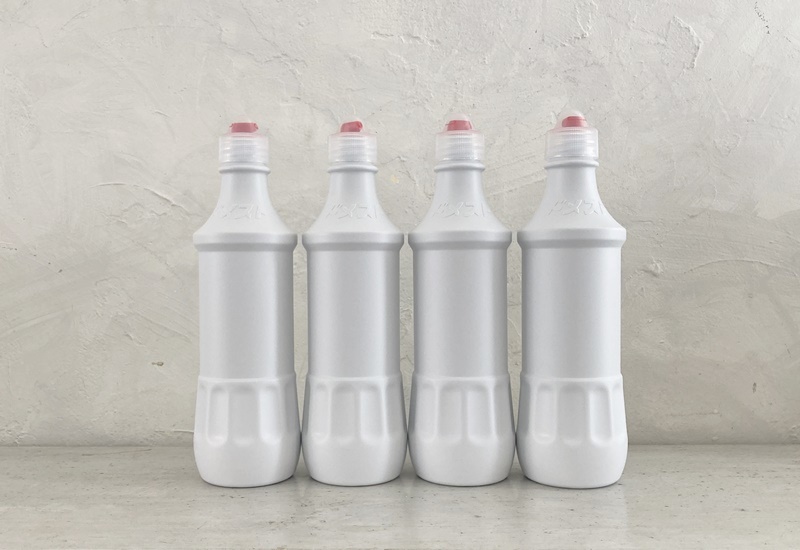
You are a GUI agent. You are given a task and a screenshot of the screen. Output one action in this format:
    pyautogui.click(x=<x>, y=<y>)
    Task: Click on the bottles
    This screenshot has width=800, height=550.
    Given the screenshot: What is the action you would take?
    pyautogui.click(x=245, y=344), pyautogui.click(x=353, y=335), pyautogui.click(x=478, y=330), pyautogui.click(x=582, y=312)